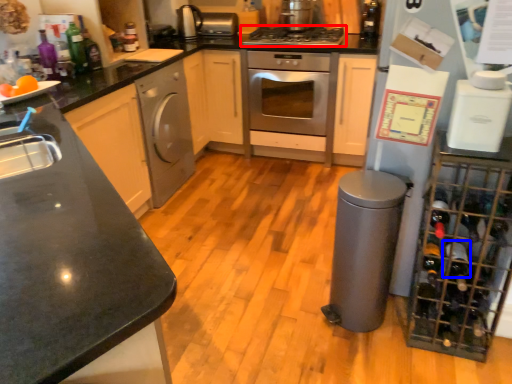
Question: Which point is closer to the camera, gas stove (highlighted by a red box) or wine bottle (highlighted by a blue box)?

Choices:
 (A) gas stove
 (B) wine bottle

Answer: (B)